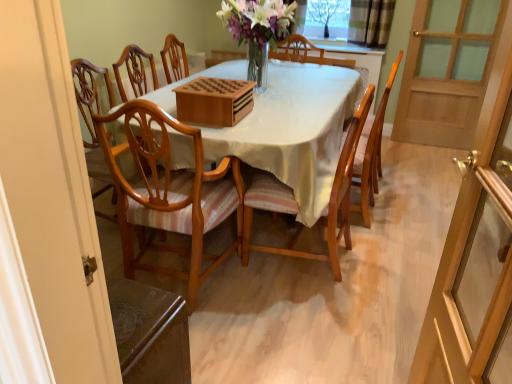
Question: Considering the relative positions of transparent glass tree at upper center and transparent glass screen door at right, the 1th screen door in the bottom-to-top sequence, in the image provided, is transparent glass tree at upper center to the left or to the right of transparent glass screen door at right, the 1th screen door in the bottom-to-top sequence,?

Choices:
 (A) left
 (B) right

Answer: (B)

Question: Considering the positions of transparent glass tree at upper center and transparent glass screen door at right, which is counted as the second screen door, starting from the top, in the image, is transparent glass tree at upper center wider or thinner than transparent glass screen door at right, which is counted as the second screen door, starting from the top,?

Choices:
 (A) thin
 (B) wide

Answer: (B)

Question: Based on their relative distances, which object is nearer to the light brown wood chair at center, arranged as the first chair when viewed from the left?

Choices:
 (A) clear glass window at upper center
 (B) wooden chair with striped cushion at center, the 2th chair viewed from the left
 (C) transparent glass tree at upper center
 (D) transparent glass screen door at right, the 1th screen door in the bottom-to-top sequence
 (E) wooden table at center

Answer: (E)

Question: Considering the real-world distances, which object is farthest from the wooden chair with striped cushion at center, the 2th chair viewed from the left?

Choices:
 (A) wooden table at center
 (B) wooden chair at center, placed as the 1th chair when sorted from right to left
 (C) wooden screen door at right, positioned as the 2th screen door in left-to-right order
 (D) translucent glass vase at center
 (E) light brown wood chair at center, arranged as the first chair when viewed from the left

Answer: (C)